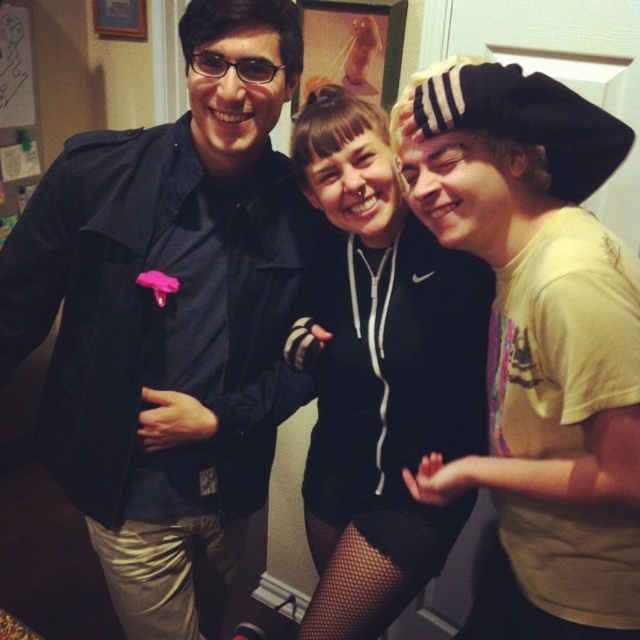
Does point (250, 426) come behind point (336, 520)?

That is False.

Which is more to the right, matte black jacket at center or black hoodie at center?

Positioned to the right is black hoodie at center.

Which is in front, point (32, 346) or point (308, 541)?

Positioned in front is point (32, 346).

The height and width of the screenshot is (640, 640). Find the location of `matte black jacket at center`. matte black jacket at center is located at coordinates (170, 320).

Does yellow matte t-shirt at right have a lesser width compared to black hoodie at center?

Indeed, yellow matte t-shirt at right has a lesser width compared to black hoodie at center.

Is point (445, 189) more distant than point (390, 220)?

No, it is not.

Does point (605, 305) come closer to viewer compared to point (346, 412)?

Yes, point (605, 305) is in front of point (346, 412).

Image resolution: width=640 pixels, height=640 pixels. Identify the location of yellow matte t-shirt at right. (538, 342).

Who is positioned more to the right, matte black jacket at center or yellow matte t-shirt at right?

From the viewer's perspective, yellow matte t-shirt at right appears more on the right side.

Is matte black jacket at center in front of yellow matte t-shirt at right?

No, it is not.

Where is `matte black jacket at center`? This screenshot has height=640, width=640. matte black jacket at center is located at coordinates (170, 320).

Identify the location of matte black jacket at center. The width and height of the screenshot is (640, 640). (170, 320).